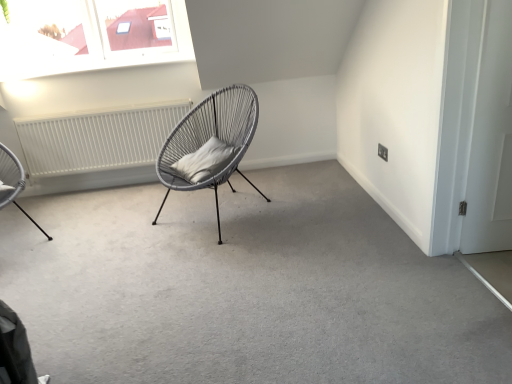
The width and height of the screenshot is (512, 384). What are the coordinates of `vacant area that lies between matte grey wicker chair at center, which appears as the 2th chair when viewed from the left, and metallic wire chair at left, which is the 1th chair from left to right` in the screenshot? It's located at (106, 226).